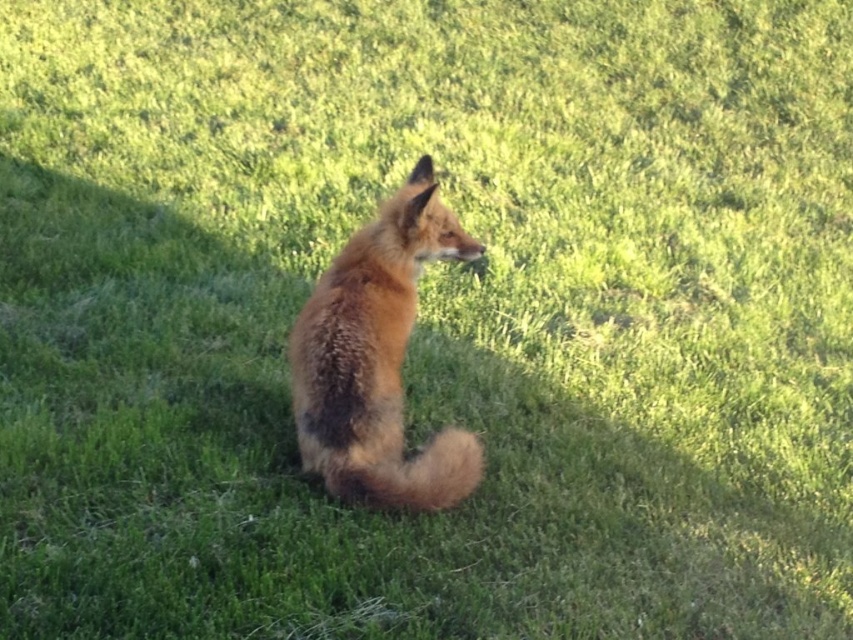
Is fluffy reddish-brown fox at center bigger than fluffy brown tail at center?

Indeed, fluffy reddish-brown fox at center has a larger size compared to fluffy brown tail at center.

Can you confirm if fluffy reddish-brown fox at center is positioned below fluffy brown tail at center?

No.

Which is behind, point (339, 428) or point (463, 484)?

The point (463, 484) is more distant.

The width and height of the screenshot is (853, 640). What are the coordinates of `fluffy reddish-brown fox at center` in the screenshot? It's located at (376, 358).